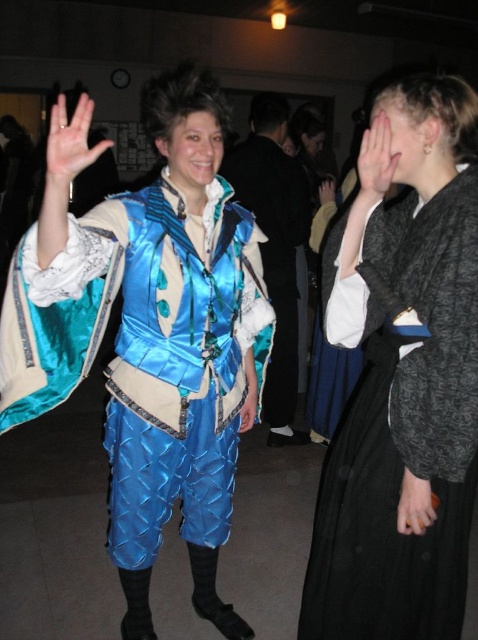
Question: Is silky black coat at center below matte black hand at upper center?

Choices:
 (A) no
 (B) yes

Answer: (B)

Question: Which point is closer to the camera?

Choices:
 (A) smooth skin hand at center
 (B) smooth brown leather hand at center right
 (C) matte black hand at upper center
 (D) black matte dress at right

Answer: (A)

Question: Estimate the real-world distances between objects in this image. Which object is closer to the shiny blue armor at center?

Choices:
 (A) matte black hand at upper center
 (B) smooth skin hand at center
 (C) blue satin hand at center
 (D) black matte dress at right

Answer: (C)

Question: Which object appears closest to the camera in this image?

Choices:
 (A) smooth brown leather hand at center right
 (B) silky black coat at center

Answer: (A)

Question: Is black matte dress at right to the left of smooth brown leather hand at center right from the viewer's perspective?

Choices:
 (A) yes
 (B) no

Answer: (A)

Question: Can you confirm if black matte dress at right is thinner than blue satin hand at center?

Choices:
 (A) no
 (B) yes

Answer: (A)